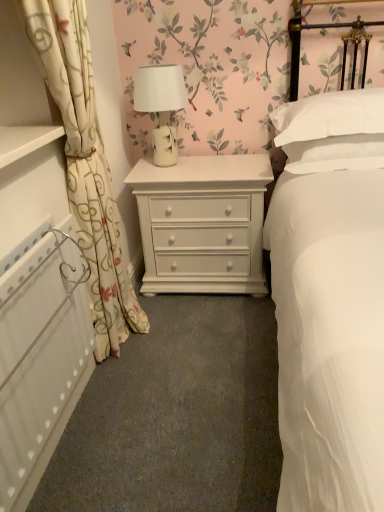
Question: Considering the positions of point (31, 384) and point (311, 105), is point (31, 384) closer or farther from the camera than point (311, 105)?

Choices:
 (A) closer
 (B) farther

Answer: (A)

Question: Considering the positions of white textured radiator at left and white soft pillow at upper right in the image, is white textured radiator at left wider or thinner than white soft pillow at upper right?

Choices:
 (A) wide
 (B) thin

Answer: (B)

Question: Based on their relative distances, which object is farther from the white ceramic lamp at center?

Choices:
 (A) white smooth bed at center
 (B) white textured radiator at left
 (C) white floral fabric curtain at left
 (D) white painted wood chest of drawers at center
 (E) white soft pillow at upper right

Answer: (B)

Question: Which is farther from the white textured radiator at left?

Choices:
 (A) white floral fabric curtain at left
 (B) white smooth bed at center
 (C) white ceramic lamp at center
 (D) white soft pillow at upper right
 (E) white painted wood chest of drawers at center

Answer: (D)